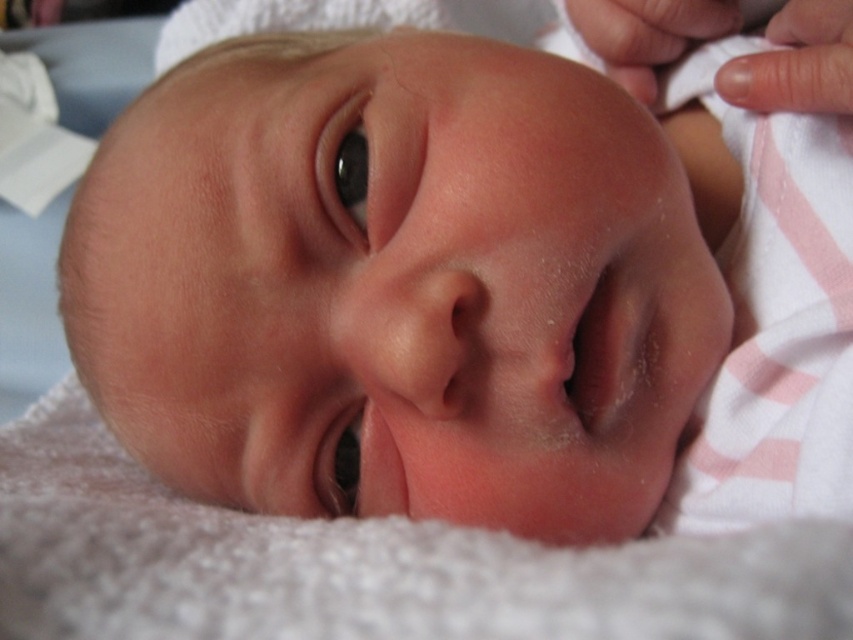
Consider the image. You are a photographer adjusting the focus on a camera lens. You want to capture both the black glossy eye at upper left and the black smooth eye at center in sharp detail. Which eye should you focus on first if you want the wider one to be in focus?

The black glossy eye at upper left has a greater width than the black smooth eye at center, so you should focus on the black glossy eye at upper left first to ensure its wider dimensions are captured sharply.

You are a photographer adjusting the focus on a camera. You need to ensure both the black glossy eye at upper left and the black smooth eye at center are in focus. Which eye should you adjust the focus for first, considering their vertical positions?

The black glossy eye at upper left has a greater height compared to the black smooth eye at center, so you should adjust the focus for the black glossy eye at upper left first as it is positioned higher vertically.

You are a pediatrician examining a baby. You notice two eyes on the baby, one is the black glossy eye at upper left and the other is the black smooth eye at center. Which eye appears larger?

The black glossy eye at upper left appears larger compared to the black smooth eye at center.